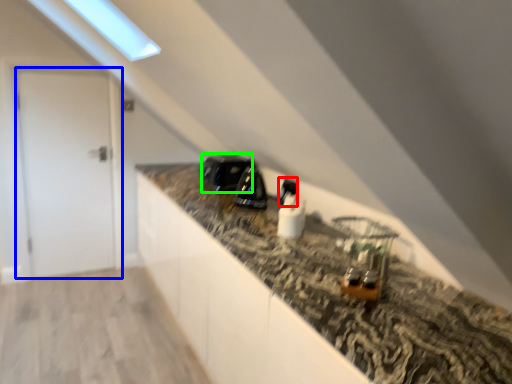
Question: Considering the real-world distances, which object is farthest from appliance (highlighted by a red box)? door (highlighted by a blue box) or appliance (highlighted by a green box)?

Choices:
 (A) door
 (B) appliance

Answer: (A)